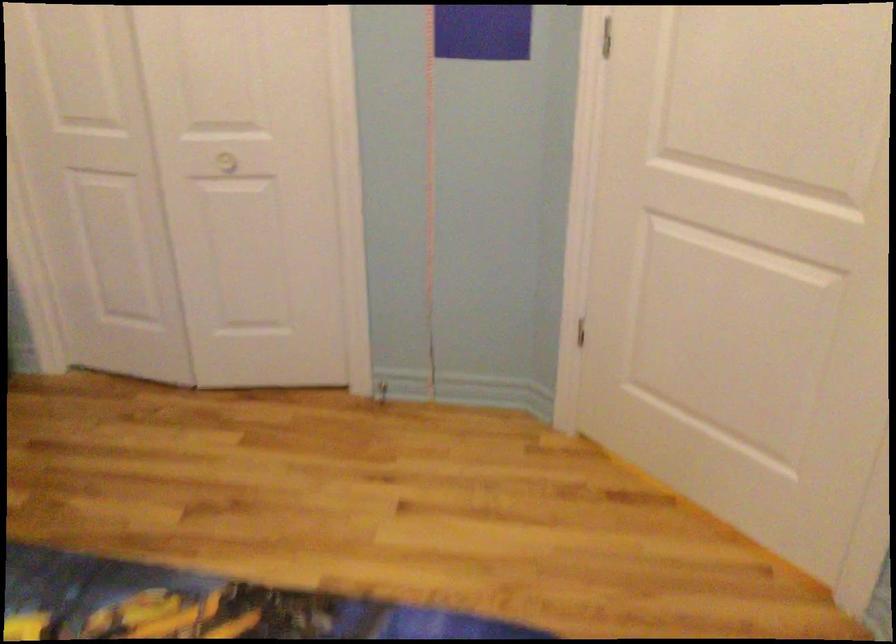
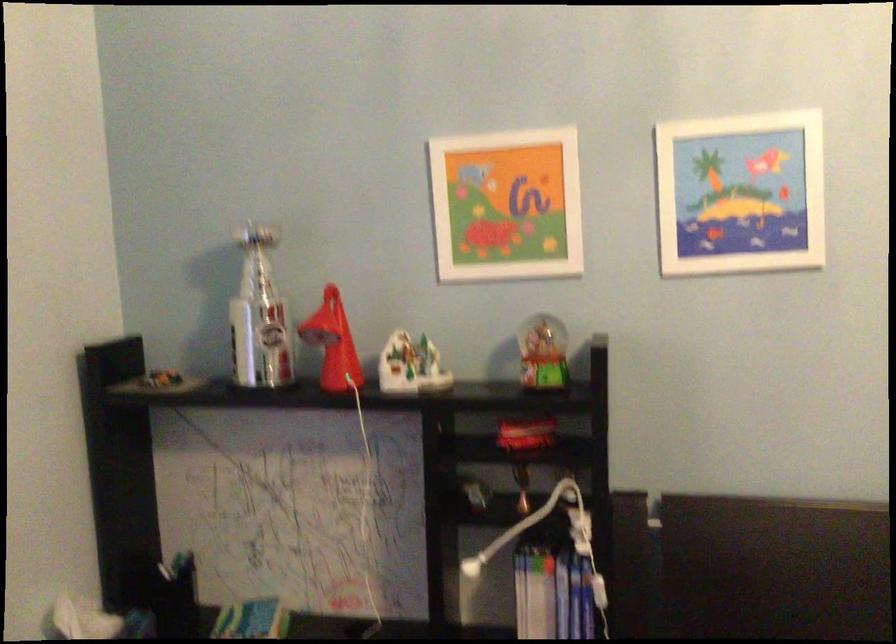
Question: The first image is from the beginning of the video and the second image is from the end. How did the camera likely rotate when shooting the video?

Choices:
 (A) Left
 (B) Right
 (C) Up
 (D) Down

Answer: (A)